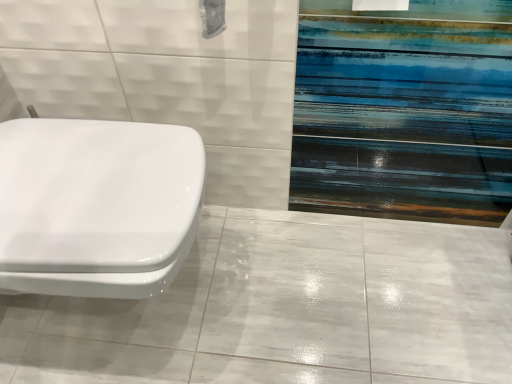
What do you see at coordinates (287, 309) in the screenshot? The height and width of the screenshot is (384, 512). I see `white glossy tile at lower left` at bounding box center [287, 309].

Locate an element on the screen. Image resolution: width=512 pixels, height=384 pixels. white glossy tile at lower left is located at coordinates (287, 309).

Where is `white glossy toilet at left`? Image resolution: width=512 pixels, height=384 pixels. white glossy toilet at left is located at coordinates (96, 206).

Describe the element at coordinates (96, 206) in the screenshot. I see `white glossy toilet at left` at that location.

Image resolution: width=512 pixels, height=384 pixels. Find the location of `white glossy tile at lower left`. white glossy tile at lower left is located at coordinates (287, 309).

Does white glossy toilet at left appear on the right side of white glossy tile at lower left?

Incorrect, white glossy toilet at left is not on the right side of white glossy tile at lower left.

Which object is more forward, white glossy toilet at left or white glossy tile at lower left?

white glossy toilet at left is in front.

Which is farther, [146,291] or [430,375]?

The point [430,375] is farther.

From the image's perspective, would you say white glossy toilet at left is shown under white glossy tile at lower left?

No, from the image's perspective, white glossy toilet at left is not beneath white glossy tile at lower left.

From a real-world perspective, which object stands above the other?

white glossy toilet at left, from a real-world perspective.

In terms of width, does white glossy toilet at left look wider or thinner when compared to white glossy tile at lower left?

In the image, white glossy toilet at left appears to be more narrow than white glossy tile at lower left.

In the scene shown: Which of these two, white glossy toilet at left or white glossy tile at lower left, stands shorter?

With less height is white glossy tile at lower left.

Can you confirm if white glossy toilet at left is bigger than white glossy tile at lower left?

Indeed, white glossy toilet at left has a larger size compared to white glossy tile at lower left.

Would you say white glossy toilet at left contains white glossy tile at lower left?

No, white glossy tile at lower left is not inside white glossy toilet at left.

Is white glossy toilet at left touching white glossy tile at lower left?

white glossy toilet at left and white glossy tile at lower left are not in contact.

Is white glossy toilet at left turned away from white glossy tile at lower left?

white glossy toilet at left does not have its back to white glossy tile at lower left.

In the scene shown: How different are the orientations of white glossy toilet at left and white glossy tile at lower left in degrees?

The angle between the facing direction of white glossy toilet at left and the facing direction of white glossy tile at lower left is 89.5 degrees.

How far apart are white glossy toilet at left and white glossy tile at lower left?

white glossy toilet at left and white glossy tile at lower left are 18.13 inches apart from each other.

At what (x,y) coordinates should I click in order to perform the action: click on toilet in front of the white glossy tile at lower left. Please return your answer as a coordinate pair (x, y). This screenshot has width=512, height=384. Looking at the image, I should click on (96, 206).

Between white glossy tile at lower left and white glossy toilet at left, which one appears on the right side from the viewer's perspective?

white glossy tile at lower left.

In the image, is white glossy tile at lower left positioned in front of or behind white glossy toilet at left?

Clearly, white glossy tile at lower left is behind white glossy toilet at left.

Looking at this image, which is closer to the camera, (258, 272) or (163, 195)?

Point (258, 272).

From the image's perspective, which is above, white glossy tile at lower left or white glossy toilet at left?

white glossy toilet at left appears higher in the image.

From a real-world perspective, is white glossy tile at lower left on white glossy toilet at left?

No, from a real-world perspective, white glossy tile at lower left is not above white glossy toilet at left.

Consider the image. Does white glossy tile at lower left have a lesser width compared to white glossy toilet at left?

No.

Considering the relative sizes of white glossy tile at lower left and white glossy toilet at left in the image provided, is white glossy tile at lower left shorter than white glossy toilet at left?

Correct, white glossy tile at lower left is not as tall as white glossy toilet at left.

Based on their sizes in the image, would you say white glossy tile at lower left is bigger or smaller than white glossy toilet at left?

Clearly, white glossy tile at lower left is smaller in size than white glossy toilet at left.

Would you say white glossy toilet at left is part of white glossy tile at lower left's contents?

Actually, white glossy toilet at left is outside white glossy tile at lower left.

Is white glossy tile at lower left positioned far away from white glossy toilet at left?

That's not correct — white glossy tile at lower left is a little close to white glossy toilet at left.

Is white glossy tile at lower left oriented towards white glossy toilet at left?

No, white glossy tile at lower left is not aimed at white glossy toilet at left.

How many degrees apart are the facing directions of white glossy tile at lower left and white glossy toilet at left?

The angular difference between white glossy tile at lower left and white glossy toilet at left is 89.5 degrees.

Identify the location of ceramic tile behind the white glossy toilet at left. (287, 309).

The image size is (512, 384). Identify the location of ceramic tile below the white glossy toilet at left (from the image's perspective). pyautogui.click(x=287, y=309).

Identify the location of ceramic tile on the right of white glossy toilet at left. The height and width of the screenshot is (384, 512). (287, 309).